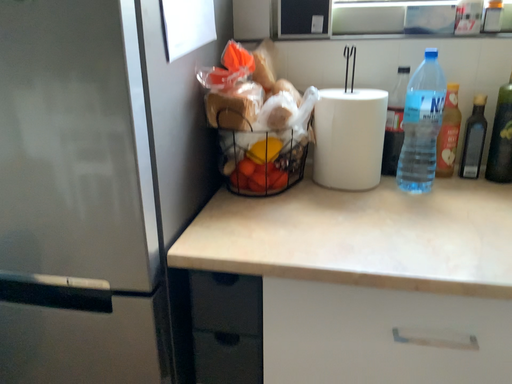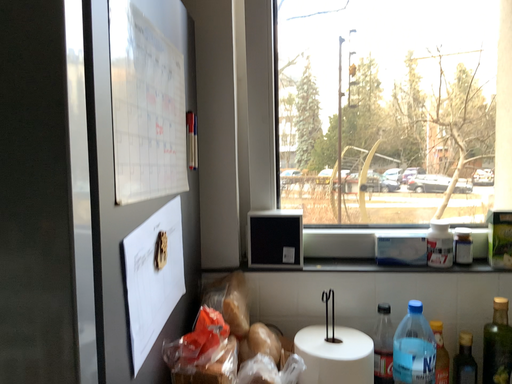
Question: Which way did the camera rotate in the video?

Choices:
 (A) rotated left
 (B) rotated right

Answer: (B)